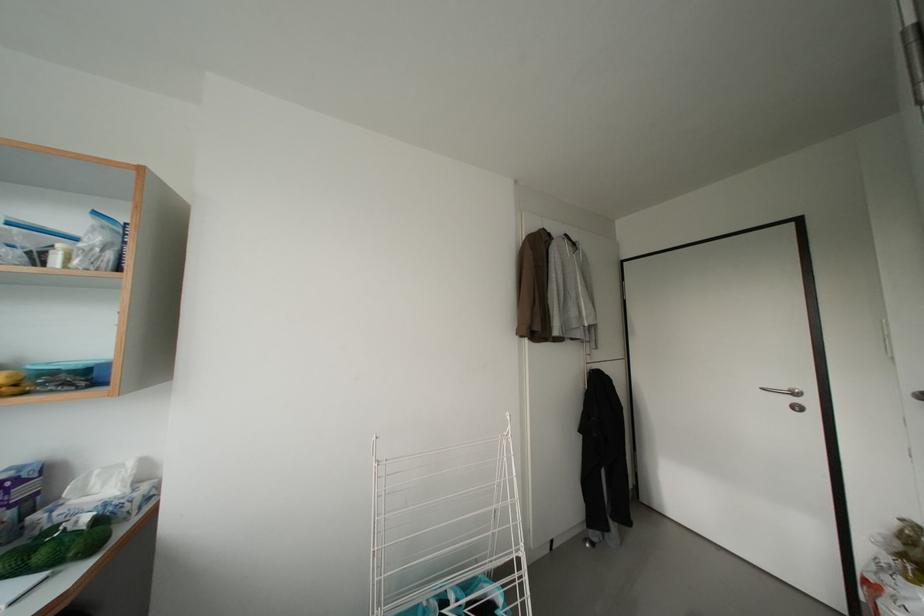
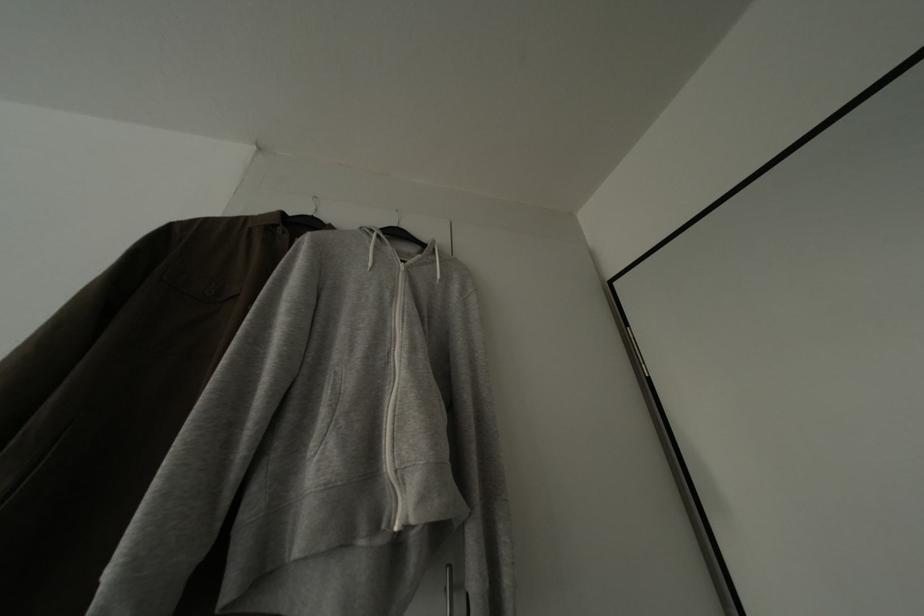
In a continuous first-person perspective shot, in which direction is the camera moving?

The movement direction of the cameraman is right, forward.